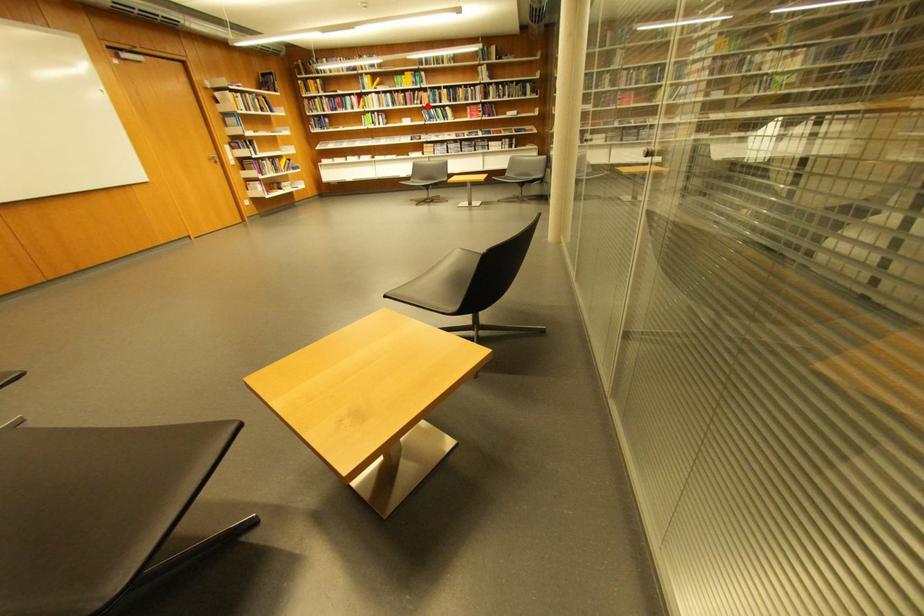
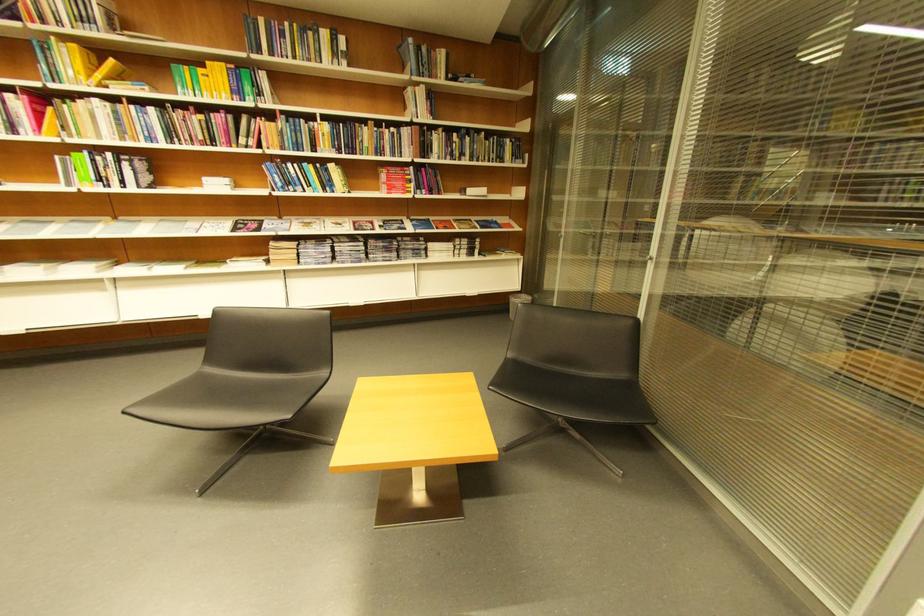
Question: I am providing you with two images of the same scene from different viewpoints. In image1, a red point is highlighted. Considering the same 3D point in image2, which of the following is correct?

Choices:
 (A) It is closer
 (B) It is farther

Answer: (B)